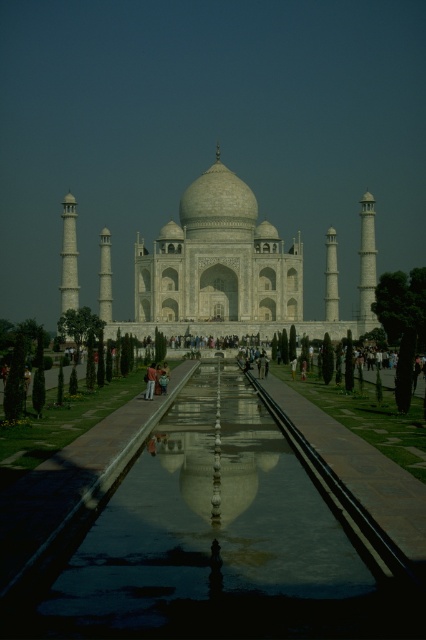
Does glossy reflective pool at center have a smaller size compared to light brown fabric person at center?

Incorrect, glossy reflective pool at center is not smaller in size than light brown fabric person at center.

Is glossy reflective pool at center to the left of light brown fabric person at center from the viewer's perspective?

In fact, glossy reflective pool at center is to the right of light brown fabric person at center.

The image size is (426, 640). Describe the element at coordinates (187, 531) in the screenshot. I see `glossy reflective pool at center` at that location.

Locate an element on the screen. This screenshot has height=640, width=426. glossy reflective pool at center is located at coordinates (187, 531).

Between glossy reflective pool at center and white marble taj mahal at center, which one has more height?

Standing taller between the two is white marble taj mahal at center.

Which is more to the right, glossy reflective pool at center or white marble taj mahal at center?

white marble taj mahal at center is more to the right.

Who is more forward, (37, 529) or (221, 188)?

Positioned in front is point (37, 529).

Image resolution: width=426 pixels, height=640 pixels. Find the location of `glossy reflective pool at center`. glossy reflective pool at center is located at coordinates (187, 531).

What do you see at coordinates (239, 262) in the screenshot? Image resolution: width=426 pixels, height=640 pixels. I see `white marble taj mahal at center` at bounding box center [239, 262].

Is point (325, 298) closer to camera compared to point (150, 371)?

No, it is not.

This screenshot has width=426, height=640. What are the coordinates of `white marble taj mahal at center` in the screenshot? It's located at (239, 262).